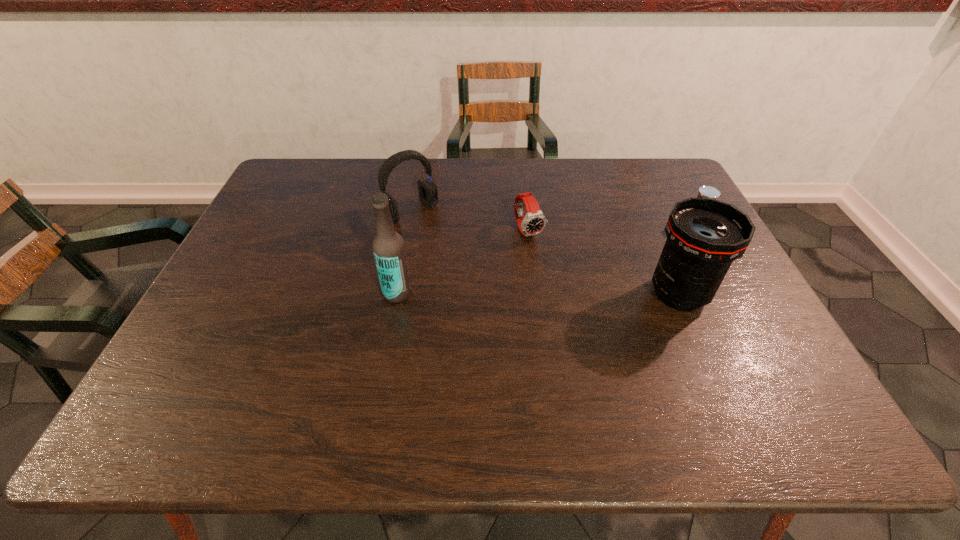
The height and width of the screenshot is (540, 960). Identify the location of vacant area between the watch and the headset. (469, 221).

Locate an element on the screen. Image resolution: width=960 pixels, height=540 pixels. empty space between the beer bottle and the telephoto lens is located at coordinates (539, 294).

You are a GUI agent. You are given a task and a screenshot of the screen. Output one action in this format:
    pyautogui.click(x=<x>, y=<y>)
    Task: Click on the vacant area between the third object from left to right and the headset
    
    Given the screenshot: What is the action you would take?
    pyautogui.click(x=469, y=221)

Where is `unoccupied area between the telephoto lens and the headset`? This screenshot has height=540, width=960. unoccupied area between the telephoto lens and the headset is located at coordinates (544, 253).

Identify which object is the third nearest to the telephoto lens. Please provide its 2D coordinates. Your answer should be formatted as a tuple, i.e. [(x, y)], where the tuple contains the x and y coordinates of a point satisfying the conditions above.

[(428, 190)]

I want to click on object that is the closest one to the fourth object from left to right, so click(x=705, y=191).

Identify the location of free spot that satisfies the following two spatial constraints: 1. on the front side of the beer bottle; 2. on the side of the third tallest object with the label. (396, 293).

Identify the location of vacant space that satisfies the following two spatial constraints: 1. on the front side of the second object from right to left; 2. on the right side of the watch. This screenshot has width=960, height=540. tap(537, 294).

You are a GUI agent. You are given a task and a screenshot of the screen. Output one action in this format:
    pyautogui.click(x=<x>, y=<y>)
    Task: Click on the free space in the image that satisfies the following two spatial constraints: 1. on the back side of the fourth object from left to right; 2. on the left side of the jam
    
    Given the screenshot: What is the action you would take?
    pos(649,225)

This screenshot has width=960, height=540. Find the location of `vacant space that satisfies the following two spatial constraints: 1. on the front side of the headset; 2. on the side of the tallest object with the label`. vacant space that satisfies the following two spatial constraints: 1. on the front side of the headset; 2. on the side of the tallest object with the label is located at coordinates (396, 293).